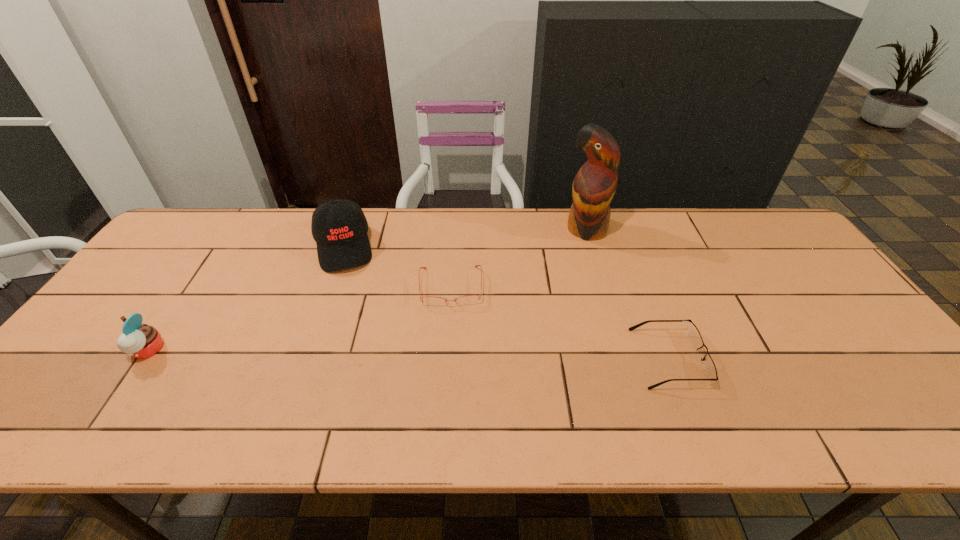
Identify the location of the leftmost object. Image resolution: width=960 pixels, height=540 pixels. (140, 341).

Locate an element on the screen. the nearer spectacles is located at coordinates (709, 367).

The height and width of the screenshot is (540, 960). In order to click on baseball cap in this screenshot , I will do `click(339, 227)`.

The image size is (960, 540). I want to click on the tallest object, so click(594, 185).

Image resolution: width=960 pixels, height=540 pixels. I want to click on the third object from right to left, so click(x=466, y=300).

Where is `the left spectacles`? Image resolution: width=960 pixels, height=540 pixels. the left spectacles is located at coordinates (466, 300).

Find the location of a particular element. free space located on the front-facing side of the muffin is located at coordinates (98, 350).

Locate an element on the screen. The image size is (960, 540). free space located on the front-facing side of the muffin is located at coordinates (93, 350).

Identify the location of free space located on the front-facing side of the muffin. Image resolution: width=960 pixels, height=540 pixels. (77, 350).

Locate an element on the screen. This screenshot has height=540, width=960. vacant space located 0.140m on the front-facing side of the right spectacles is located at coordinates (760, 359).